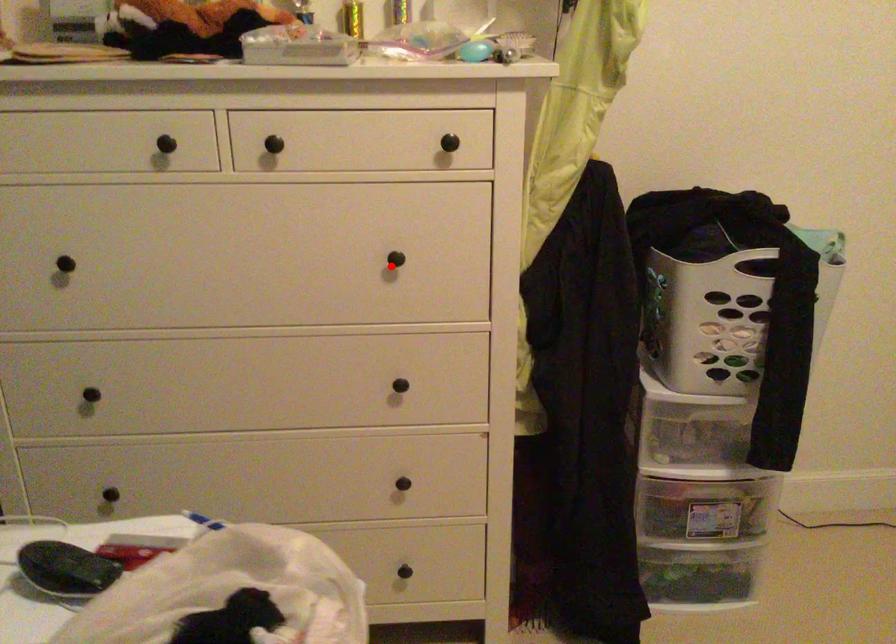
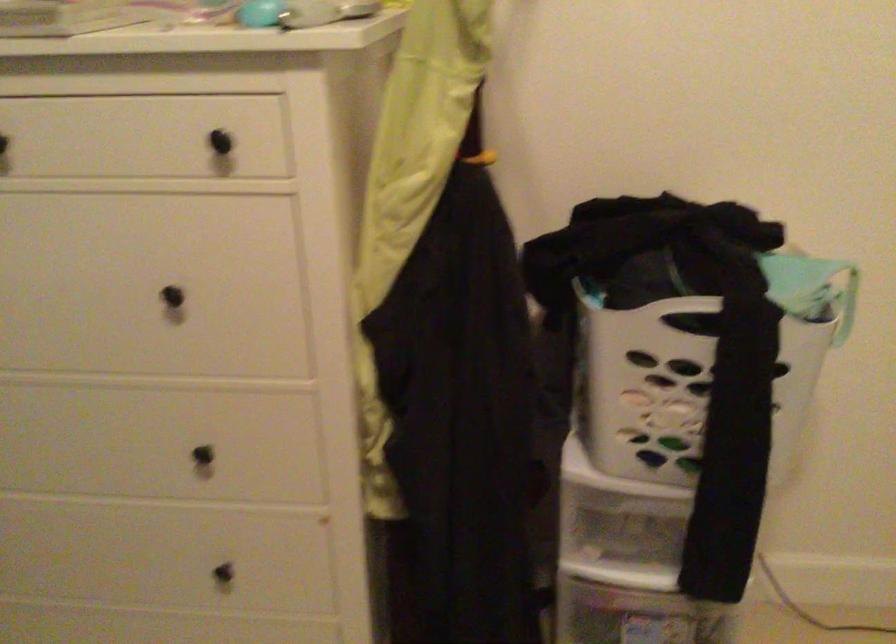
Find the pixel in the second image that matches the highlighted location in the first image.

(178, 305)